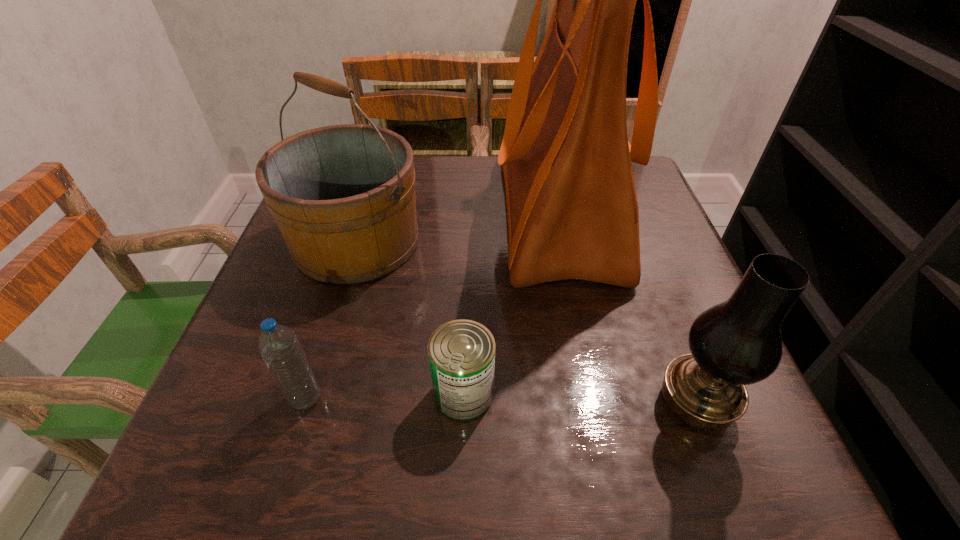
This screenshot has width=960, height=540. What are the coordinates of `object that is at the far left corner` in the screenshot? It's located at (343, 196).

This screenshot has height=540, width=960. I want to click on object at the far right corner, so click(x=572, y=209).

The height and width of the screenshot is (540, 960). I want to click on object positioned at the near right corner, so click(x=738, y=342).

At what (x,y) coordinates should I click in order to perform the action: click on free space at the far edge of the desktop. Please return your answer as a coordinate pair (x, y). This screenshot has width=960, height=540. Looking at the image, I should click on (455, 193).

In the image, there is a desktop. At what (x,y) coordinates should I click in order to perform the action: click on vacant space at the near edge. Please return your answer as a coordinate pair (x, y). Looking at the image, I should click on (471, 437).

In the image, there is a desktop. Where is `blank space at the left edge`? blank space at the left edge is located at coordinates (330, 327).

The height and width of the screenshot is (540, 960). I want to click on vacant space at the right edge of the desktop, so click(662, 316).

In the image, there is a desktop. Where is `free space at the near left corner`? The width and height of the screenshot is (960, 540). free space at the near left corner is located at coordinates (229, 471).

I want to click on vacant space at the far right corner of the desktop, so 642,204.

Where is `vacant position at the near right corner of the desktop`? The width and height of the screenshot is (960, 540). vacant position at the near right corner of the desktop is located at coordinates (745, 461).